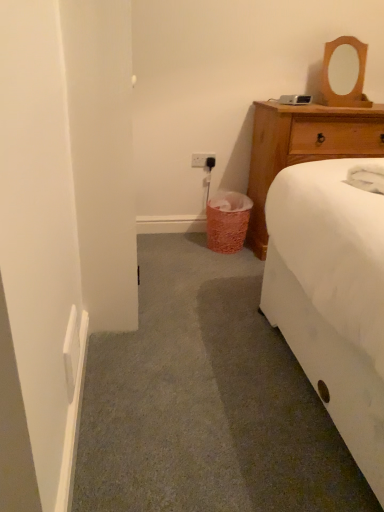
Question: In the image, is white plastic power outlet at center on the left side or the right side of wooden mirror at upper right?

Choices:
 (A) right
 (B) left

Answer: (B)

Question: Which is correct: white plastic power outlet at center is inside wooden mirror at upper right, or outside of it?

Choices:
 (A) inside
 (B) outside

Answer: (B)

Question: Estimate the real-world distances between objects in this image. Which object is farther from the white plastic power outlet at center?

Choices:
 (A) wooden dresser at upper right
 (B) wooden mirror at upper right
 (C) pink textured trash can at lower center

Answer: (B)

Question: Based on their relative distances, which object is farther from the pink textured trash can at lower center?

Choices:
 (A) wooden mirror at upper right
 (B) white plastic power outlet at center
 (C) wooden dresser at upper right

Answer: (A)